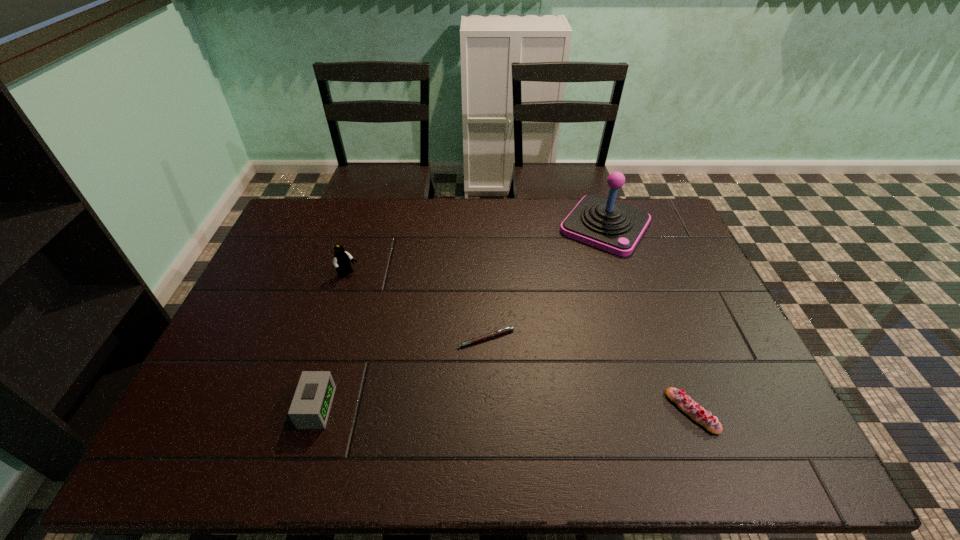
Find the location of `vacant area located at the nib of the pen`. vacant area located at the nib of the pen is located at coordinates (472, 383).

What are the coordinates of `free space located at the nib of the pen` in the screenshot? It's located at (472, 387).

Find the location of a particular element. The height and width of the screenshot is (540, 960). vacant space located at the nib of the pen is located at coordinates (466, 416).

Where is `vacant space situated forward from the base of the joystick`? vacant space situated forward from the base of the joystick is located at coordinates (557, 293).

At what (x,y) coordinates should I click in order to perform the action: click on vacant space located 0.250m forward from the base of the joystick. Please return your answer as a coordinate pair (x, y). This screenshot has width=960, height=540. Looking at the image, I should click on (554, 298).

The height and width of the screenshot is (540, 960). In order to click on vacant space located forward from the base of the joystick in this screenshot , I will do `click(531, 330)`.

The width and height of the screenshot is (960, 540). I want to click on vacant space located 0.250m on the front-facing side of the fourth shortest object, so click(406, 322).

Find the location of a particular element. Image resolution: width=960 pixels, height=540 pixels. vacant region located on the front-facing side of the fourth shortest object is located at coordinates (380, 301).

You are a GUI agent. You are given a task and a screenshot of the screen. Output one action in this format:
    pyautogui.click(x=<x>, y=<y>)
    Task: Click on the free space located on the front-facing side of the fourth shortest object
    
    Given the screenshot: What is the action you would take?
    pyautogui.click(x=397, y=315)

Locate an element on the screen. This screenshot has height=540, width=960. object located at the far edge is located at coordinates (603, 223).